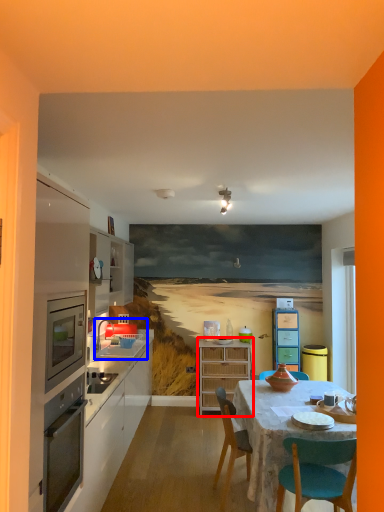
Question: Which object is closer to the camera taking this photo, cabinetry (highlighted by a red box) or sink (highlighted by a blue box)?

Choices:
 (A) cabinetry
 (B) sink

Answer: (B)